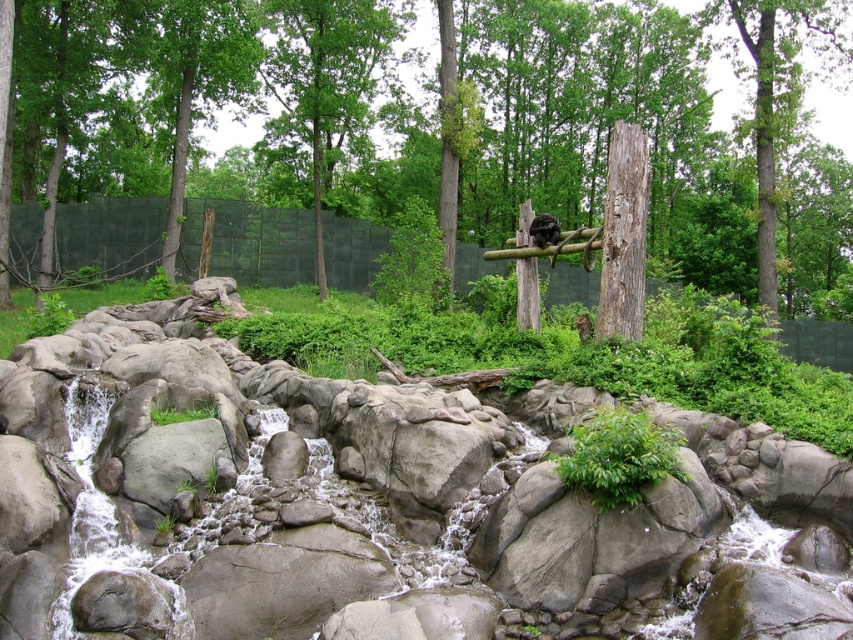
Question: Estimate the real-world distances between objects in this image. Which object is farther from the green leafy tree at center?

Choices:
 (A) brown rough tree trunk at upper center
 (B) black fur monkey at center

Answer: (B)

Question: Is green leafy tree at center below brown rough tree trunk at upper center?

Choices:
 (A) yes
 (B) no

Answer: (B)

Question: Which of the following is the farthest from the observer?

Choices:
 (A) brown rough tree trunk at upper center
 (B) green leafy tree at center

Answer: (B)

Question: Which of the following is the farthest from the observer?

Choices:
 (A) (144, 10)
 (B) (308, 116)
 (C) (776, 51)
 (D) (549, 220)

Answer: (B)

Question: Is smooth gray rock at center above brown rough tree trunk at upper center?

Choices:
 (A) no
 (B) yes

Answer: (B)

Question: Does green leafy tree at center have a smaller size compared to brown rough tree trunk at upper center?

Choices:
 (A) no
 (B) yes

Answer: (A)